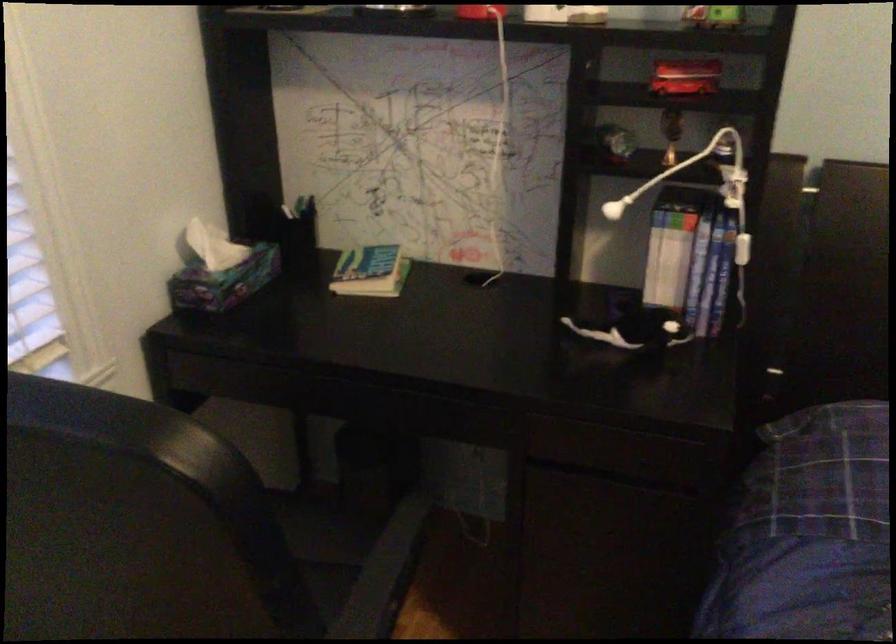
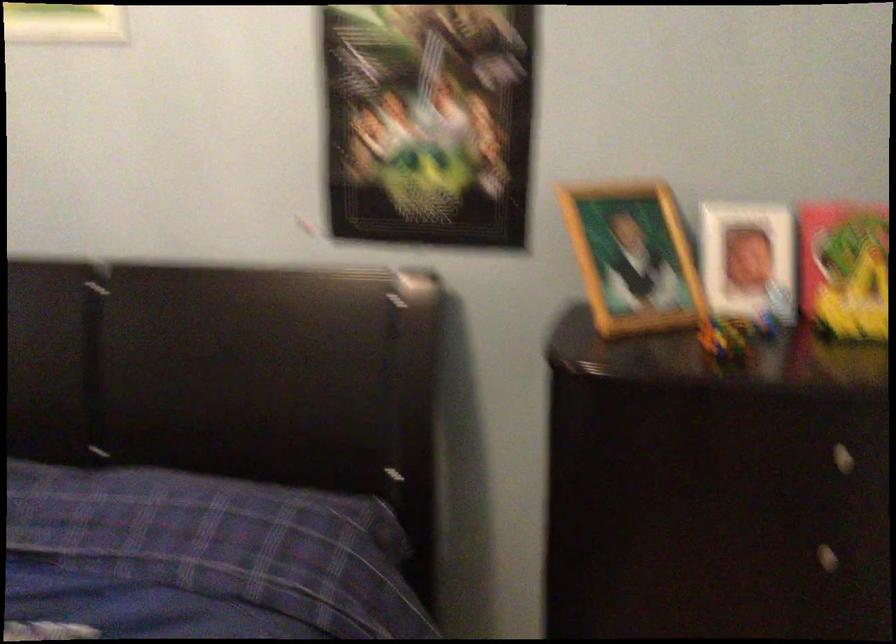
Question: The images are taken continuously from a first-person perspective. In which direction are you moving?

Choices:
 (A) Left
 (B) Right
 (C) Forward
 (D) Backward

Answer: (B)